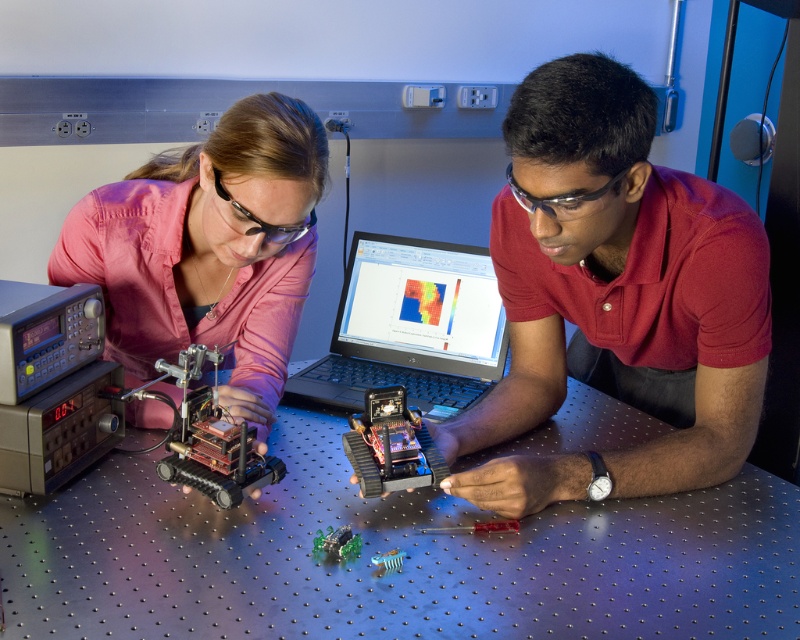
You are standing in front of the workbench and want to know which point is closer to you. The points are labeled as point 1 at coordinates point (81, 344) and point 2 at coordinates point (200, 362). Which point is closer to you?

Point (81, 344) is closer to you because it is further to the viewer than point (200, 362).

You are observing two people working on a robotics project at a workshop. You notice the matte pink shirt at upper left and the metallic circuit board at left. Which object is positioned higher up in the image?

The matte pink shirt at upper left is taller than the metallic circuit board at left, so the matte pink shirt at upper left is positioned higher up in the image.

You are a visitor observing the scene. You see the matte pink shirt at upper left and the metallic circuit board at left. Which object is positioned higher in the image?

The matte pink shirt at upper left is located above the metallic circuit board at left, so it is positioned higher in the image.